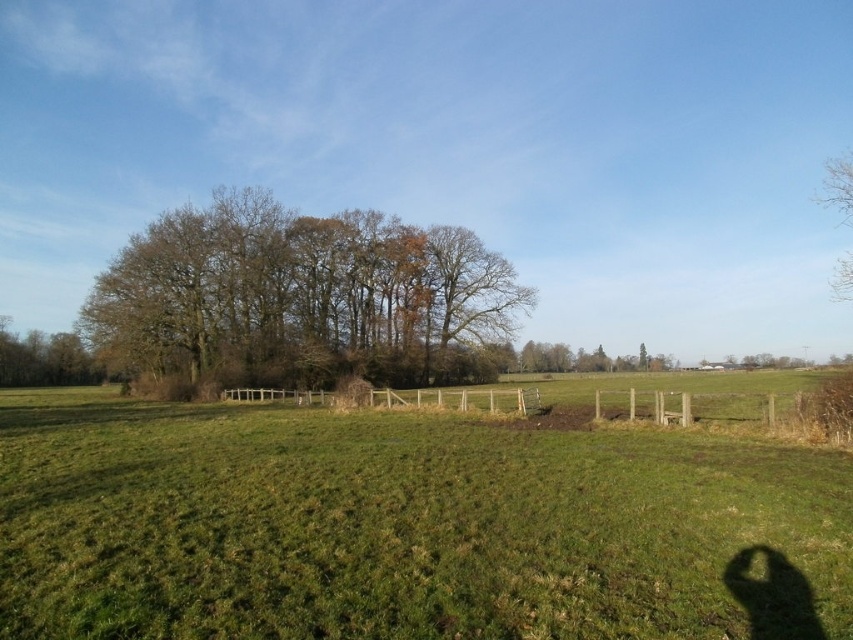
Which is below, green grassy field at center or bare branches at upper right?

green grassy field at center is below.

Who is more distant from viewer, (161, 582) or (845, 280)?

Point (845, 280)

The height and width of the screenshot is (640, 853). I want to click on green grassy field at center, so click(405, 525).

Does green grassy field at center lie in front of brown leafy tree at center?

Yes, green grassy field at center is closer to the viewer.

Which is more to the right, green grassy field at center or brown leafy tree at center?

Positioned to the right is green grassy field at center.

I want to click on green grassy field at center, so click(405, 525).

Locate an element on the screen. green grassy field at center is located at coordinates (405, 525).

What do you see at coordinates (44, 358) in the screenshot? This screenshot has height=640, width=853. I see `brown textured tree at left` at bounding box center [44, 358].

Which is more to the right, brown textured tree at left or bare branches at upper right?

Positioned to the right is bare branches at upper right.

What are the coordinates of `brown textured tree at left` in the screenshot? It's located at (44, 358).